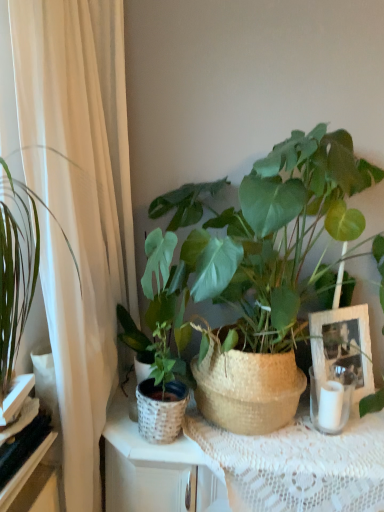
What do you see at coordinates (318, 405) in the screenshot? The height and width of the screenshot is (512, 384). I see `white glass candle holder at right` at bounding box center [318, 405].

Describe the element at coordinates (343, 347) in the screenshot. I see `white wicker picture frame at center right` at that location.

In the scene shown: What is the approximate height of green woven basket at center, the second houseplant in the right-to-left sequence?

15.03 inches.

In order to face green woven basket at center, which is counted as the second houseplant, starting from the left, should I rotate leftwards or rightwards?

Rotate your view right by about 12.525°.

At what (x,y) coordinates should I click in order to perform the action: click on white glass candle holder at right. Please return your answer as a coordinate pair (x, y). Looking at the image, I should click on (318, 405).

Which of these two, white lace tablecloth at center or black glossy shelf at lower left, arranged as the 2th shelf when viewed from the top, is thinner?

black glossy shelf at lower left, arranged as the 2th shelf when viewed from the top, is thinner.

From the white lace tablecloth at center, count 2nd shelfs forward and point to it. Please provide its 2D coordinates.

[(26, 469)]

In the image, is white lace tablecloth at center on the left side or the right side of black glossy shelf at lower left, which is the 1th shelf from bottom to top?

white lace tablecloth at center is to the right of black glossy shelf at lower left, which is the 1th shelf from bottom to top.

Considering the sizes of objects white glass candle holder at right and green woven basket at center, acting as the 1th houseplant starting from the left, in the image provided, who is wider, white glass candle holder at right or green woven basket at center, acting as the 1th houseplant starting from the left,?

With larger width is green woven basket at center, acting as the 1th houseplant starting from the left.

Is white glass candle holder at right positioned far away from green woven basket at center, acting as the 1th houseplant starting from the left?

No.

From a real-world perspective, is white glass candle holder at right above or below green woven basket at center, acting as the 1th houseplant starting from the left?

From a real-world perspective, white glass candle holder at right is physically below green woven basket at center, acting as the 1th houseplant starting from the left.

Which object is further away from the camera taking this photo, white glass candle holder at right or green woven basket at center, the second houseplant in the right-to-left sequence?

white glass candle holder at right.

Is white woven basket at left, which ranks as the second shelf in bottom-to-top order, a part of green woven basket at center, which is counted as the second houseplant, starting from the left?

Actually, white woven basket at left, which ranks as the second shelf in bottom-to-top order, is outside green woven basket at center, which is counted as the second houseplant, starting from the left.

In terms of width, does green woven basket at center, which is counted as the second houseplant, starting from the left, look wider or thinner when compared to white woven basket at left, which is the first shelf from top to bottom?

In the image, green woven basket at center, which is counted as the second houseplant, starting from the left, appears to be wider than white woven basket at left, which is the first shelf from top to bottom.

Is green woven basket at center, acting as the first houseplant starting from the right, facing away from white woven basket at left, which ranks as the second shelf in bottom-to-top order?

That's not correct — green woven basket at center, acting as the first houseplant starting from the right, is not looking away from white woven basket at left, which ranks as the second shelf in bottom-to-top order.

From the image's perspective, between green woven basket at center, which is counted as the second houseplant, starting from the left, and white sheer curtain at left, who is located below?

From the image's view, white sheer curtain at left is below.

How distant is green woven basket at center, acting as the first houseplant starting from the right, from white sheer curtain at left?

green woven basket at center, acting as the first houseplant starting from the right, and white sheer curtain at left are 17.58 inches apart from each other.

Could you tell me if green woven basket at center, acting as the first houseplant starting from the right, is turned towards white sheer curtain at left?

Yes, green woven basket at center, acting as the first houseplant starting from the right, is oriented towards white sheer curtain at left.

Between black glossy shelf at lower left, which is the 1th shelf from bottom to top, and green woven basket at center, acting as the first houseplant starting from the right, which one has larger size?

Bigger between the two is green woven basket at center, acting as the first houseplant starting from the right.

Which shelf is the 2nd one when counting from the left side of the green woven basket at center, which is counted as the second houseplant, starting from the left? Please provide its 2D coordinates.

[(26, 469)]

Consider the image. Does black glossy shelf at lower left, arranged as the 2th shelf when viewed from the top, lie behind green woven basket at center, acting as the first houseplant starting from the right?

That is False.

Could you measure the distance between white lace tablecloth at center and green woven basket at center, which is counted as the second houseplant, starting from the left?

A distance of 14.55 inches exists between white lace tablecloth at center and green woven basket at center, which is counted as the second houseplant, starting from the left.

From their relative heights in the image, would you say white lace tablecloth at center is taller or shorter than green woven basket at center, acting as the first houseplant starting from the right?

white lace tablecloth at center is shorter than green woven basket at center, acting as the first houseplant starting from the right.

In order to click on table located below the green woven basket at center, which is counted as the second houseplant, starting from the left (from the image's perspective) in this screenshot , I will do `click(244, 466)`.

From a real-world perspective, which object stands above the other?

green woven basket at center, which is counted as the second houseplant, starting from the left, from a real-world perspective.

From the image's perspective, which is above, white glass candle holder at right or green woven basket at center, acting as the first houseplant starting from the right?

green woven basket at center, acting as the first houseplant starting from the right, from the image's perspective.

Is point (348, 415) farther from camera compared to point (304, 218)?

That is True.

Does white glass candle holder at right have a lesser height compared to green woven basket at center, acting as the first houseplant starting from the right?

Indeed, white glass candle holder at right has a lesser height compared to green woven basket at center, acting as the first houseplant starting from the right.

Considering the sizes of objects white glass candle holder at right and green woven basket at center, which is counted as the second houseplant, starting from the left, in the image provided, who is thinner, white glass candle holder at right or green woven basket at center, which is counted as the second houseplant, starting from the left,?

white glass candle holder at right is thinner.

From the image's perspective, which shelf is the 1st one above the white lace tablecloth at center? Please provide its 2D coordinates.

[(26, 469)]

Image resolution: width=384 pixels, height=512 pixels. I want to click on candle holder below the green woven basket at center, acting as the 1th houseplant starting from the left (from a real-world perspective), so click(318, 405).

Which object lies nearer to the anchor point white sheer curtain at left, green woven basket at center, the second houseplant in the right-to-left sequence, or white glass candle holder at right?

green woven basket at center, the second houseplant in the right-to-left sequence.

When comparing their distances from green woven basket at center, the second houseplant in the right-to-left sequence, does white glass candle holder at right or white wicker picture frame at center right seem further?

white wicker picture frame at center right lies further to green woven basket at center, the second houseplant in the right-to-left sequence, than the other object.

Looking at the image, which one is located further to black glossy shelf at lower left, arranged as the 2th shelf when viewed from the top, white lace tablecloth at center or green woven basket at center, acting as the first houseplant starting from the right?

Answer: Among the two, green woven basket at center, acting as the first houseplant starting from the right, is located further to black glossy shelf at lower left, arranged as the 2th shelf when viewed from the top.

Considering their positions, is white woven basket at left, which ranks as the second shelf in bottom-to-top order, positioned closer to white glass candle holder at right than white wicker picture frame at center right?

white wicker picture frame at center right is positioned closer to the anchor white glass candle holder at right.

Considering their positions, is green woven basket at center, which is counted as the second houseplant, starting from the left, positioned further to white woven basket at left, which ranks as the second shelf in bottom-to-top order, than white glass candle holder at right?

white glass candle holder at right is positioned further to the anchor white woven basket at left, which ranks as the second shelf in bottom-to-top order.

Estimate the real-world distances between objects in this image. Which object is closer to white sheer curtain at left, white lace tablecloth at center or white glass candle holder at right?

Based on the image, white lace tablecloth at center appears to be nearer to white sheer curtain at left.

Looking at the image, which one is located closer to white sheer curtain at left, white wicker picture frame at center right or black glossy shelf at lower left, arranged as the 2th shelf when viewed from the top?

Based on the image, black glossy shelf at lower left, arranged as the 2th shelf when viewed from the top, appears to be nearer to white sheer curtain at left.

When comparing their distances from white wicker picture frame at center right, does green woven basket at center, acting as the first houseplant starting from the right, or black glossy shelf at lower left, arranged as the 2th shelf when viewed from the top, seem closer?

green woven basket at center, acting as the first houseplant starting from the right.

Identify the location of curtain situated between white woven basket at left, which is the first shelf from top to bottom, and white wicker picture frame at center right from left to right. (78, 206).

Identify the location of shelf between white sheer curtain at left and white woven basket at left, which ranks as the second shelf in bottom-to-top order, along the z-axis. (26, 469).

Find the location of a particular element. This screenshot has height=512, width=384. table positioned between white sheer curtain at left and white wicker picture frame at center right from near to far is located at coordinates (244, 466).

Where is `houseplant between green woven basket at center, which is counted as the second houseplant, starting from the left, and white lace tablecloth at center vertically`? This screenshot has height=512, width=384. houseplant between green woven basket at center, which is counted as the second houseplant, starting from the left, and white lace tablecloth at center vertically is located at coordinates (158, 348).